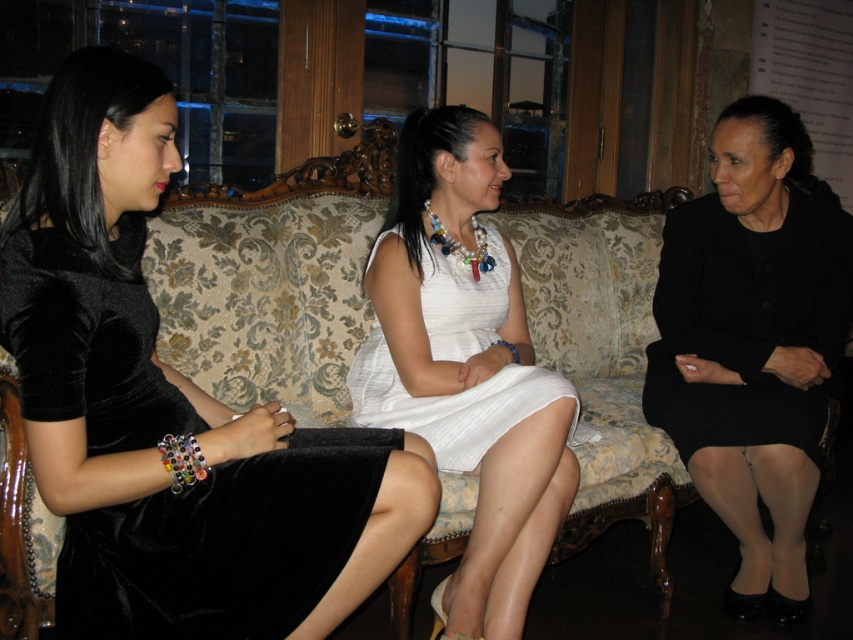
Question: Based on their relative distances, which object is farther from the floral-patterned fabric couch at center?

Choices:
 (A) white satin dress at center
 (B) black matte dress at right
 (C) velvet black dress at left
 (D) white cotton dress at center

Answer: (C)

Question: Does velvet black dress at left have a smaller size compared to black matte dress at right?

Choices:
 (A) yes
 (B) no

Answer: (A)

Question: Which object appears closest to the camera in this image?

Choices:
 (A) velvet black dress at left
 (B) white cotton dress at center
 (C) floral-patterned fabric couch at center

Answer: (A)

Question: Can you confirm if floral-patterned fabric couch at center is thinner than white cotton dress at center?

Choices:
 (A) yes
 (B) no

Answer: (B)

Question: Estimate the real-world distances between objects in this image. Which object is closer to the black matte dress at right?

Choices:
 (A) white cotton dress at center
 (B) white satin dress at center
 (C) floral-patterned fabric couch at center

Answer: (C)

Question: Is black matte dress at right bigger than white cotton dress at center?

Choices:
 (A) yes
 (B) no

Answer: (A)